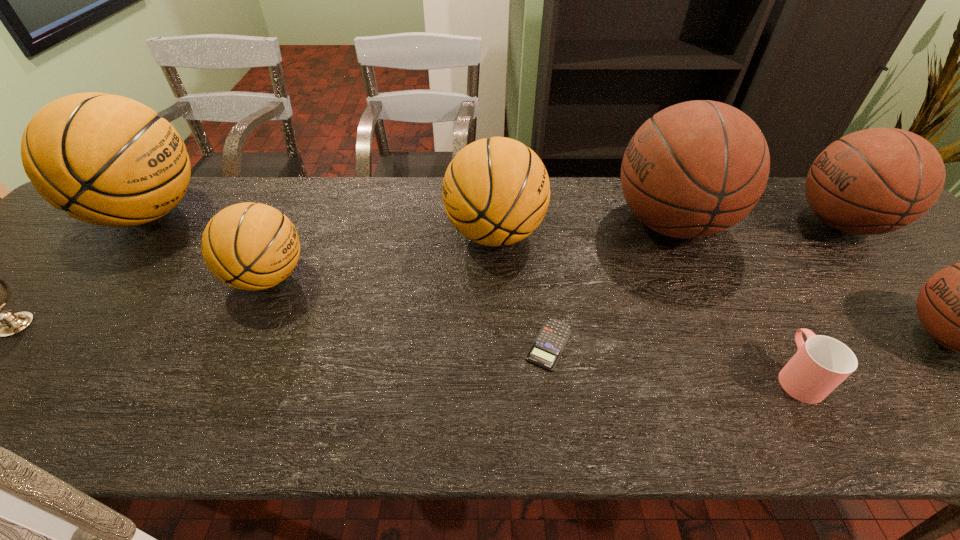
The image size is (960, 540). I want to click on calculator, so click(545, 351).

Locate an element on the screen. the shortest object is located at coordinates (545, 351).

Locate an element on the screen. vacant area situated on the surface of the biggest orange basketball near the brand logo is located at coordinates (342, 214).

Image resolution: width=960 pixels, height=540 pixels. I want to click on vacant region located on the side with brand label of the fourth basketball from left to right, so click(518, 224).

Locate an element on the screen. free space located 0.140m on the side with brand label of the fourth basketball from left to right is located at coordinates (559, 224).

At what (x,y) coordinates should I click in order to perform the action: click on vacant space situated on the side with brand label of the fourth basketball from left to right. Please return your answer as a coordinate pair (x, y). This screenshot has width=960, height=540. Looking at the image, I should click on pos(581,224).

You are a GUI agent. You are given a task and a screenshot of the screen. Output one action in this format:
    pyautogui.click(x=<x>, y=<y>)
    Task: Click on the vacant space located 0.380m on the surface of the second biggest orange basketball near the brand logo
    
    Given the screenshot: What is the action you would take?
    tap(302, 234)

At what (x,y) coordinates should I click in order to perform the action: click on vacant region located 0.160m on the surface of the second biggest orange basketball near the brand logo. Please return your answer as a coordinate pair (x, y). Looking at the image, I should click on (385, 234).

This screenshot has height=540, width=960. Identify the location of vacant space located 0.400m on the surface of the second biggest orange basketball near the brand logo. (296, 234).

Find the location of `vacant space located 0.240m on the side with brand label of the second biggest brown basketball`. vacant space located 0.240m on the side with brand label of the second biggest brown basketball is located at coordinates (705, 223).